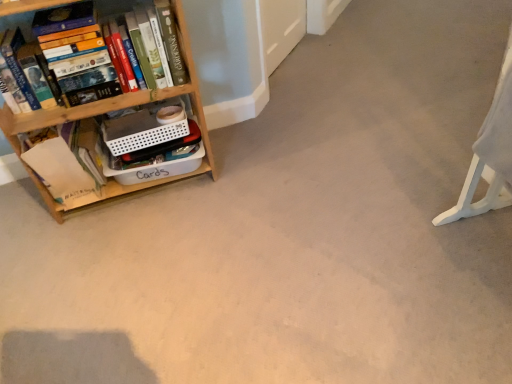
Describe the element at coordinates (475, 191) in the screenshot. I see `white plastic swivel chair at right` at that location.

Find the location of a particular element. white paper at left is located at coordinates (62, 170).

Measure the distance between point [35,6] and camera.

Point [35,6] is 1.52 meters away from camera.

Locate an element on the screen. white plastic swivel chair at right is located at coordinates (475, 191).

Considering the relative sizes of white paper at left and wooden bookshelf at left in the image provided, is white paper at left wider than wooden bookshelf at left?

No.

Would you say wooden bookshelf at left is part of white paper at left's contents?

Definitely not — wooden bookshelf at left is not inside white paper at left.

What's the angular difference between white paper at left and wooden bookshelf at left's facing directions?

The angle between the facing direction of white paper at left and the facing direction of wooden bookshelf at left is 0.805 degrees.

Considering the relative positions of white paper at left and wooden bookshelf at left in the image provided, is white paper at left to the right of wooden bookshelf at left from the viewer's perspective?

Incorrect, white paper at left is not on the right side of wooden bookshelf at left.

Is hardcover book at left positioned beyond the bounds of white plastic swivel chair at right?

hardcover book at left is positioned outside white plastic swivel chair at right.

Where is `book lying above the white plastic swivel chair at right (from the image's perspective)`? book lying above the white plastic swivel chair at right (from the image's perspective) is located at coordinates (27, 7).

Considering the positions of point (30, 14) and point (488, 182), is point (30, 14) closer or farther from the camera than point (488, 182)?

Point (30, 14) appears to be closer to the viewer than point (488, 182).

Is hardcover book at left touching white plastic swivel chair at right?

No.

Considering the positions of objects wooden bookshelf at left and hardcover book at left in the image provided, who is behind, wooden bookshelf at left or hardcover book at left?

hardcover book at left.

This screenshot has width=512, height=384. I want to click on shelf on the left of hardcover book at left, so click(x=121, y=107).

Is wooden bookshelf at left turned away from hardcover book at left?

Yes, wooden bookshelf at left is facing away from hardcover book at left.

From a real-world perspective, which is physically below, wooden bookshelf at left or hardcover book at left?

In real-world perspective, wooden bookshelf at left is lower.

Based on the photo, is white paper at left spatially inside white plastic swivel chair at right, or outside of it?

white paper at left cannot be found inside white plastic swivel chair at right.

Is white paper at left closer to the viewer compared to white plastic swivel chair at right?

That is False.

From a real-world perspective, is white paper at left on white plastic swivel chair at right?

No.

From the image's perspective, does white plastic swivel chair at right appear higher than wooden bookshelf at left?

No, from the image's perspective, white plastic swivel chair at right is not over wooden bookshelf at left.

Can you tell me how much white plastic swivel chair at right and wooden bookshelf at left differ in facing direction?

The angle between the facing direction of white plastic swivel chair at right and the facing direction of wooden bookshelf at left is 93.7 degrees.

Is the surface of white plastic swivel chair at right in direct contact with wooden bookshelf at left?

white plastic swivel chair at right is not next to wooden bookshelf at left, and they're not touching.

In terms of height, does wooden bookshelf at left look taller or shorter compared to white paper at left?

In the image, wooden bookshelf at left appears to be taller than white paper at left.

Are wooden bookshelf at left and white paper at left making contact?

No, wooden bookshelf at left is not next to white paper at left.

Considering the sizes of objects wooden bookshelf at left and white paper at left in the image provided, who is bigger, wooden bookshelf at left or white paper at left?

wooden bookshelf at left is bigger.

Does hardcover book at left contain white paper at left?

No, hardcover book at left does not contain white paper at left.

This screenshot has height=384, width=512. I want to click on paperback book that is on the left side of hardcover book at left, so [x=62, y=170].

Considering the relative sizes of hardcover book at left and white paper at left in the image provided, is hardcover book at left thinner than white paper at left?

Yes, hardcover book at left is thinner than white paper at left.

Is hardcover book at left oriented away from white paper at left?

No, white paper at left is not at the back of hardcover book at left.

The height and width of the screenshot is (384, 512). Find the location of `shelf in front of the white paper at left`. shelf in front of the white paper at left is located at coordinates (121, 107).

Where is `book to the left of white plastic swivel chair at right`? The width and height of the screenshot is (512, 384). book to the left of white plastic swivel chair at right is located at coordinates (27, 7).

Considering their positions, is wooden bookshelf at left positioned further to white paper at left than hardcover book at left?

hardcover book at left lies further to white paper at left than the other object.

From the image, which object appears to be nearer to white paper at left, hardcover book at left or white plastic swivel chair at right?

Among the two, hardcover book at left is located nearer to white paper at left.

Estimate the real-world distances between objects in this image. Which object is closer to white plastic swivel chair at right, wooden bookshelf at left or white paper at left?

Among the two, wooden bookshelf at left is located nearer to white plastic swivel chair at right.

Based on their spatial positions, is white paper at left or hardcover book at left closer to white plastic swivel chair at right?

white paper at left is positioned closer to the anchor white plastic swivel chair at right.

When comparing their distances from hardcover book at left, does white plastic swivel chair at right or white paper at left seem further?

white plastic swivel chair at right is further to hardcover book at left.

Based on the photo, looking at the image, which one is located closer to wooden bookshelf at left, white plastic swivel chair at right or white paper at left?

Based on the image, white paper at left appears to be nearer to wooden bookshelf at left.

Estimate the real-world distances between objects in this image. Which object is closer to white paper at left, hardcover book at left or wooden bookshelf at left?

wooden bookshelf at left is closer to white paper at left.

From the image, which object appears to be nearer to wooden bookshelf at left, hardcover book at left or white plastic swivel chair at right?

hardcover book at left is closer to wooden bookshelf at left.

In order to click on book located between white paper at left and white plastic swivel chair at right in the left-right direction in this screenshot , I will do `click(27, 7)`.

Identify the location of shelf that lies between hardcover book at left and white paper at left from top to bottom. The width and height of the screenshot is (512, 384). (121, 107).

Identify the location of shelf situated between white paper at left and white plastic swivel chair at right from left to right. The image size is (512, 384). (121, 107).

You are a GUI agent. You are given a task and a screenshot of the screen. Output one action in this format:
    pyautogui.click(x=<x>, y=<y>)
    Task: Click on the book located between wooden bookshelf at left and white plastic swivel chair at right in the left-right direction
    The image size is (512, 384).
    Given the screenshot: What is the action you would take?
    pyautogui.click(x=27, y=7)